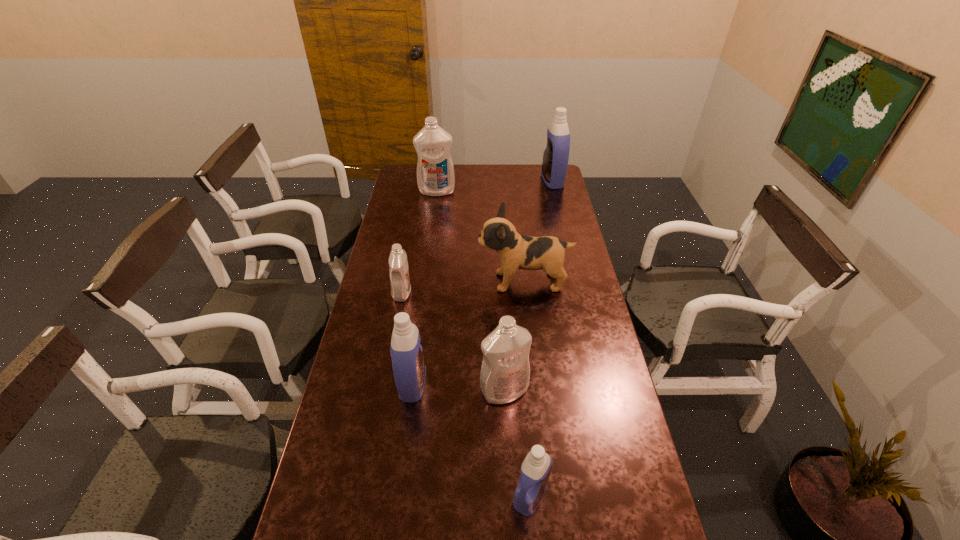
In order to click on free space located on the left of the nearest detergent in this screenshot , I will do `click(409, 495)`.

Identify the location of detergent that is at the right edge. The height and width of the screenshot is (540, 960). (556, 155).

Where is `puppy that is at the right edge`? The image size is (960, 540). puppy that is at the right edge is located at coordinates (516, 251).

Where is `object that is at the far left corner`? object that is at the far left corner is located at coordinates (435, 172).

You are a GUI agent. You are given a task and a screenshot of the screen. Output one action in this format:
    pyautogui.click(x=<x>, y=<y>)
    Task: Click on the object that is positioned at the far right corner
    This screenshot has width=960, height=540.
    Given the screenshot: What is the action you would take?
    pyautogui.click(x=556, y=155)

This screenshot has height=540, width=960. In the image, there is a desktop. What are the coordinates of `free space at the far edge` in the screenshot? It's located at (490, 172).

Where is `free location at the left edge`? The width and height of the screenshot is (960, 540). free location at the left edge is located at coordinates (420, 196).

The height and width of the screenshot is (540, 960). In the image, there is a desktop. Identify the location of vacant space at the right edge. (612, 400).

The height and width of the screenshot is (540, 960). Identify the location of vacant area at the far left corner. (398, 178).

You are a GUI agent. You are given a task and a screenshot of the screen. Output one action in this format:
    pyautogui.click(x=<x>, y=<y>)
    Task: Click on the empty location between the farthest white detergent and the nearest white detergent
    This screenshot has width=960, height=540.
    Given the screenshot: What is the action you would take?
    pyautogui.click(x=470, y=291)